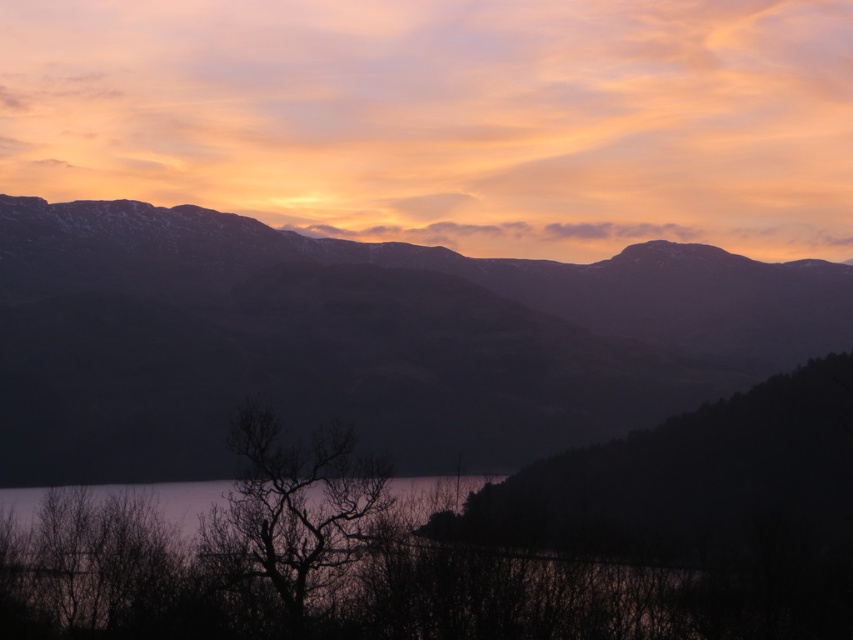
How far apart are dark purple mountain range at center and silhouette bare tree at center?

The distance of dark purple mountain range at center from silhouette bare tree at center is 839.99 feet.

Is dark purple mountain range at center wider than silhouette bare tree at center?

Indeed, dark purple mountain range at center has a greater width compared to silhouette bare tree at center.

Locate an element on the screen. Image resolution: width=853 pixels, height=640 pixels. dark purple mountain range at center is located at coordinates (363, 339).

Locate an element on the screen. The width and height of the screenshot is (853, 640). dark purple mountain range at center is located at coordinates (363, 339).